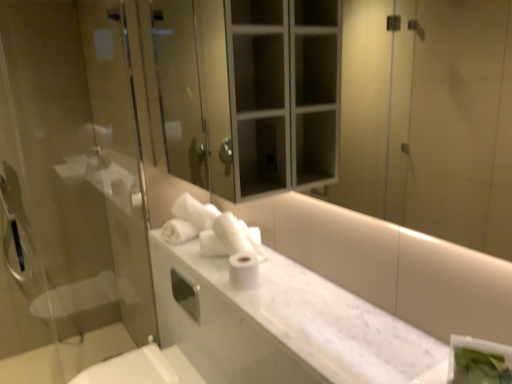
The height and width of the screenshot is (384, 512). What are the coordinates of `free space that is to the left of white matte toilet paper at center` in the screenshot? It's located at (207, 276).